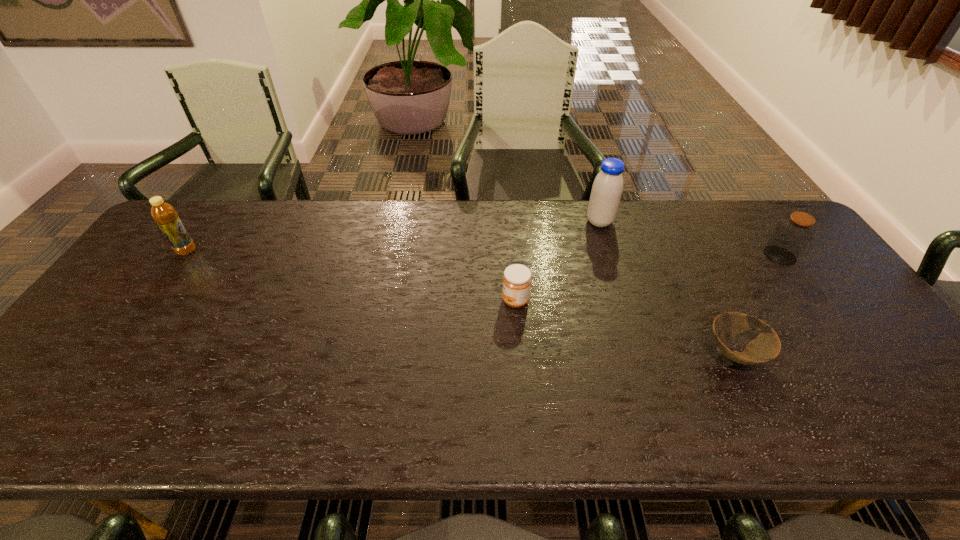
Locate an element on the screen. The height and width of the screenshot is (540, 960). object located at the left edge is located at coordinates (164, 214).

Where is `object present at the right edge`? object present at the right edge is located at coordinates (792, 235).

Find the location of a particular element. object present at the far left corner is located at coordinates (164, 214).

The width and height of the screenshot is (960, 540). I want to click on object present at the far right corner, so click(792, 235).

This screenshot has height=540, width=960. I want to click on vacant area at the far edge of the desktop, so click(616, 238).

The image size is (960, 540). What are the coordinates of `free location at the near edge of the desktop` in the screenshot? It's located at (399, 410).

Where is `vacant space at the left edge of the desktop`? The image size is (960, 540). vacant space at the left edge of the desktop is located at coordinates (94, 339).

Identify the location of free point at the right edge. Image resolution: width=960 pixels, height=540 pixels. (842, 315).

Find the location of a particular element. Image resolution: width=960 pixels, height=540 pixels. vacant space at the far right corner of the desktop is located at coordinates (760, 220).

Where is `vacant space that's between the jam and the bottle`? This screenshot has width=960, height=540. vacant space that's between the jam and the bottle is located at coordinates (351, 276).